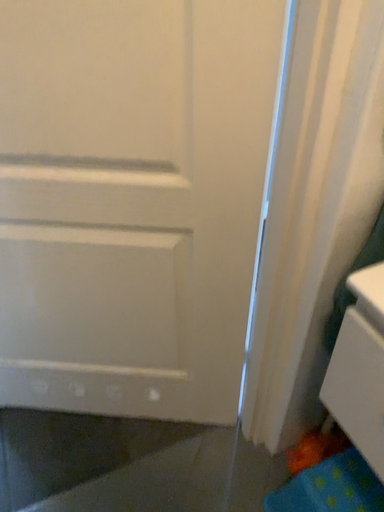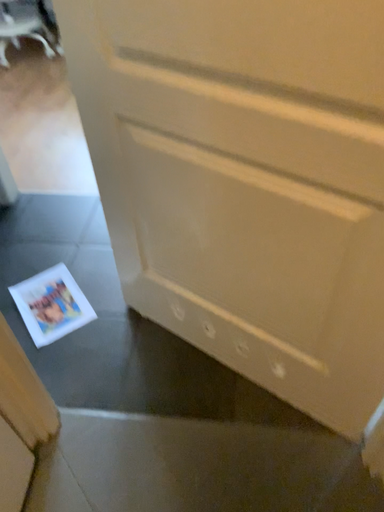
Question: Which way did the camera rotate in the video?

Choices:
 (A) rotated left
 (B) rotated right

Answer: (A)